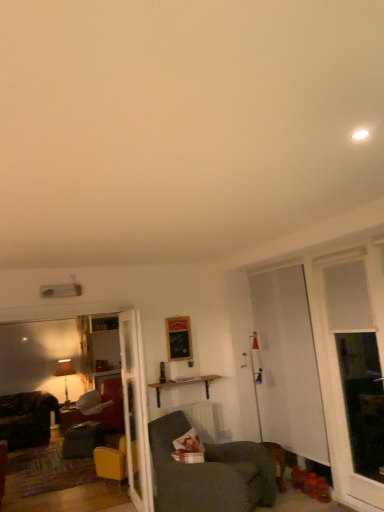
Question: Does velvet dark grey swivel chair at lower left have a greater height compared to dark gray fabric chair at lower center, which is counted as the second chair, starting from the back?

Choices:
 (A) no
 (B) yes

Answer: (A)

Question: Is velvet dark grey swivel chair at lower left oriented towards dark gray fabric chair at lower center, which is counted as the second chair, starting from the back?

Choices:
 (A) yes
 (B) no

Answer: (B)

Question: Is velvet dark grey swivel chair at lower left positioned with its back to dark gray fabric chair at lower center, the first chair viewed from the right?

Choices:
 (A) no
 (B) yes

Answer: (A)

Question: Can you confirm if velvet dark grey swivel chair at lower left is positioned to the left of dark gray fabric chair at lower center, the first chair viewed from the right?

Choices:
 (A) yes
 (B) no

Answer: (A)

Question: Does velvet dark grey swivel chair at lower left contain dark gray fabric chair at lower center, the 1th chair when ordered from front to back?

Choices:
 (A) no
 (B) yes

Answer: (A)

Question: Is wooden picture frame at center taller or shorter than white translucent screen door at right?

Choices:
 (A) tall
 (B) short

Answer: (B)

Question: Is wooden picture frame at center wider or thinner than white translucent screen door at right?

Choices:
 (A) thin
 (B) wide

Answer: (A)

Question: Looking at the image, does wooden picture frame at center seem bigger or smaller compared to white translucent screen door at right?

Choices:
 (A) small
 (B) big

Answer: (A)

Question: Is wooden picture frame at center inside or outside of white translucent screen door at right?

Choices:
 (A) inside
 (B) outside

Answer: (B)

Question: Which is correct: velvet dark grey swivel chair at lower left is inside white translucent screen door at right, or outside of it?

Choices:
 (A) outside
 (B) inside

Answer: (A)

Question: Looking at the image, does velvet dark grey swivel chair at lower left seem bigger or smaller compared to white translucent screen door at right?

Choices:
 (A) big
 (B) small

Answer: (B)

Question: Is velvet dark grey swivel chair at lower left to the left or to the right of white translucent screen door at right in the image?

Choices:
 (A) left
 (B) right

Answer: (A)

Question: Looking at their shapes, would you say velvet dark grey swivel chair at lower left is wider or thinner than white translucent screen door at right?

Choices:
 (A) thin
 (B) wide

Answer: (B)

Question: Considering their positions, is white glossy door at center located in front of or behind white textured window at right?

Choices:
 (A) front
 (B) behind

Answer: (B)

Question: Does point (132, 403) appear closer or farther from the camera than point (350, 448)?

Choices:
 (A) farther
 (B) closer

Answer: (A)